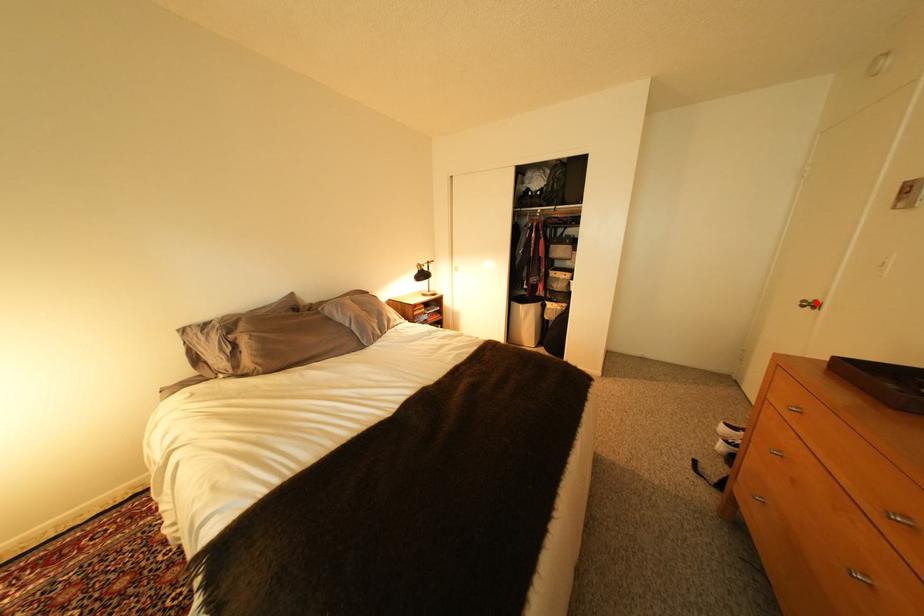
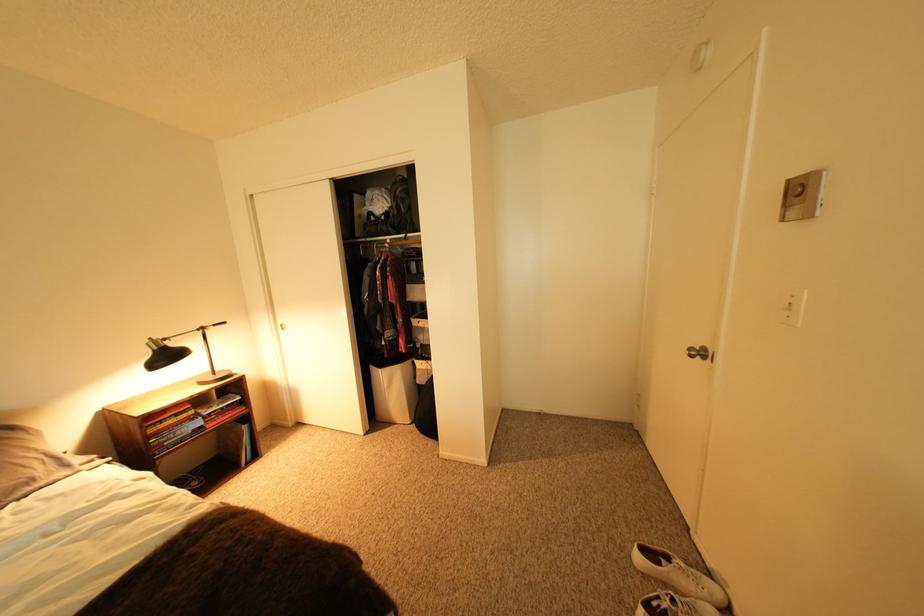
The point at the highlighted location is marked in the first image. Where is the corresponding point in the second image?

(703, 351)